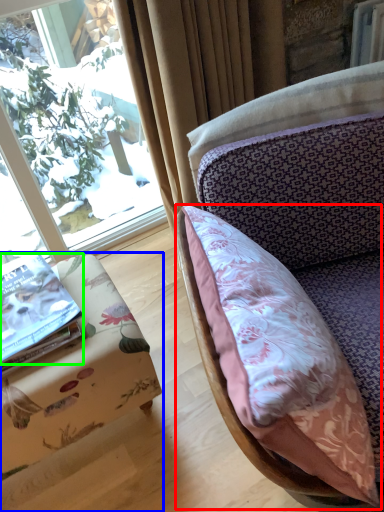
Question: Which object is positioned farthest from pillow (highlighted by a red box)? Select from furniture (highlighted by a blue box) and book (highlighted by a green box).

Choices:
 (A) furniture
 (B) book

Answer: (B)